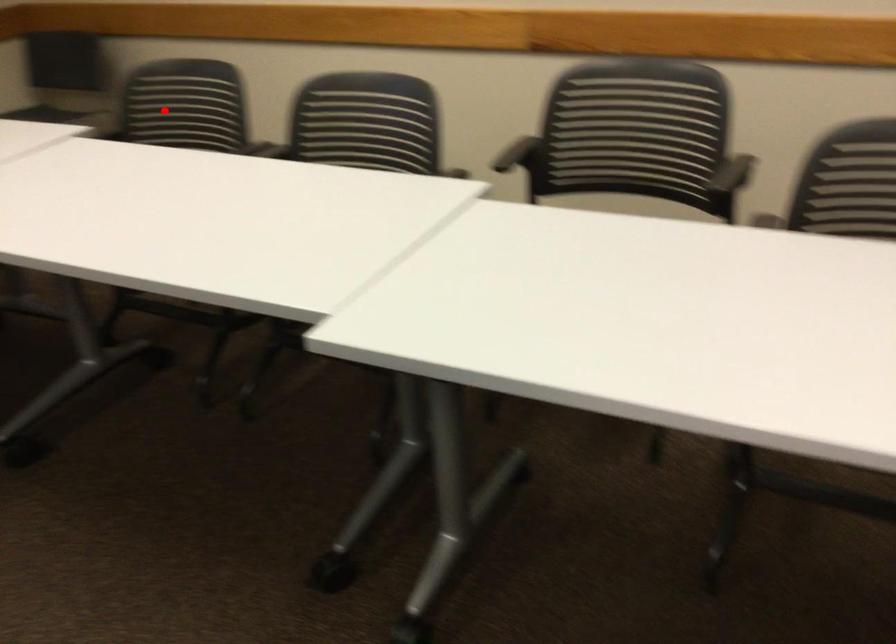
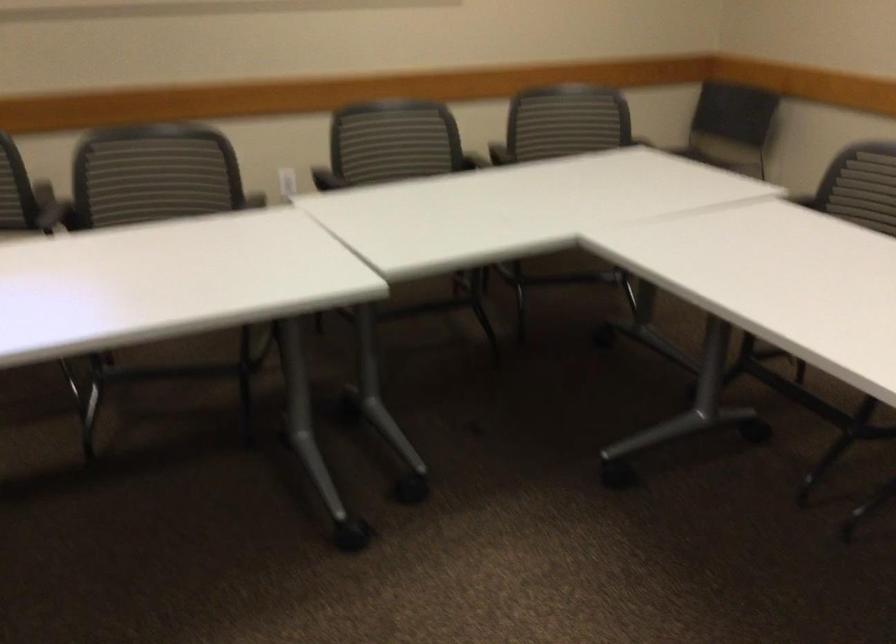
Locate, in the second image, the point that corresponds to the highlighted location in the first image.

(866, 185)